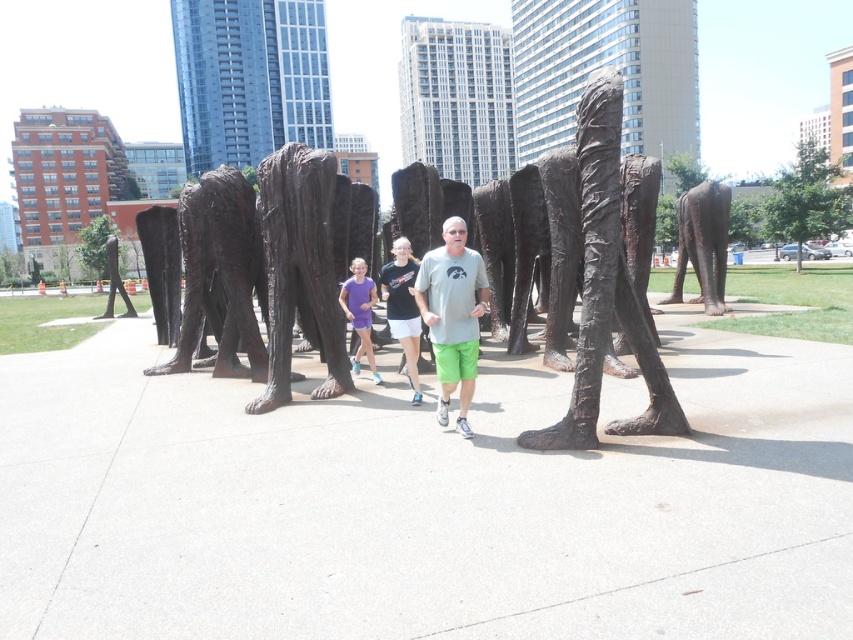
Question: Which of the following is the closest to the observer?

Choices:
 (A) matte black t-shirt at center
 (B) matte gray t-shirt at center
 (C) smooth concrete pavement at center
 (D) bronze sculpture at center

Answer: (C)

Question: From the image, what is the correct spatial relationship of bronze sculpture at center in relation to matte gray t-shirt at center?

Choices:
 (A) below
 (B) above

Answer: (B)

Question: Does matte black t-shirt at center have a smaller size compared to bronze statue at left?

Choices:
 (A) no
 (B) yes

Answer: (B)

Question: Does bronze sculpture at center appear on the left side of matte black t-shirt at center?

Choices:
 (A) yes
 (B) no

Answer: (B)

Question: Estimate the real-world distances between objects in this image. Which object is farther from the matte black t-shirt at center?

Choices:
 (A) smooth concrete pavement at center
 (B) bronze statue at center
 (C) bronze statue at left

Answer: (C)

Question: Which object is the farthest from the matte gray t-shirt at center?

Choices:
 (A) bronze statue at center
 (B) bronze textured sculpture at center
 (C) matte black t-shirt at center

Answer: (A)